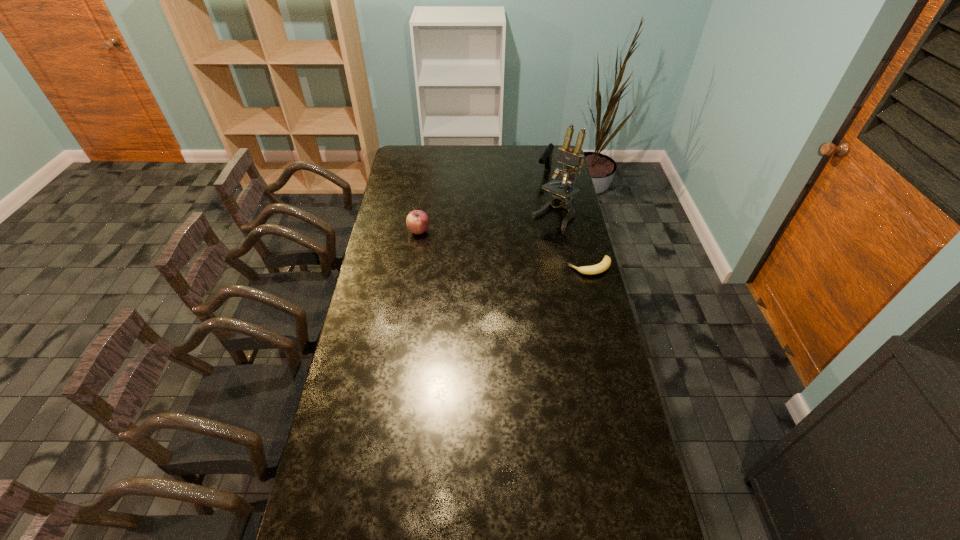
The height and width of the screenshot is (540, 960). I want to click on vacant space on the desktop that is between the apple and the banana and is positioned at the barrel of the second tallest object, so click(497, 248).

Locate an element on the screen. free space on the desktop that is between the leftmost object and the nearest object and is positioned at the eyepieces of the microscope is located at coordinates (516, 252).